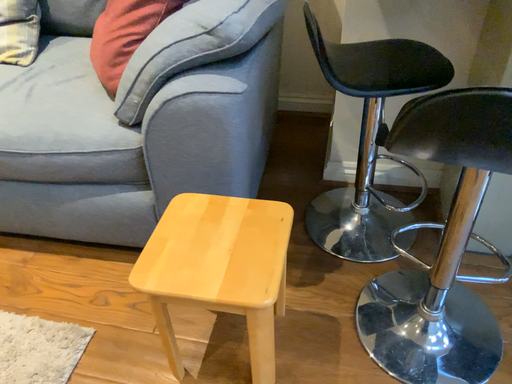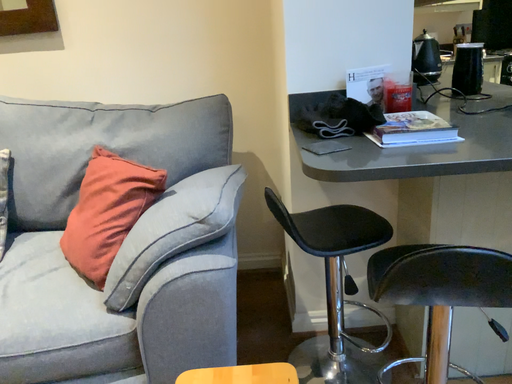
Question: Which way did the camera rotate in the video?

Choices:
 (A) rotated right
 (B) rotated left

Answer: (A)